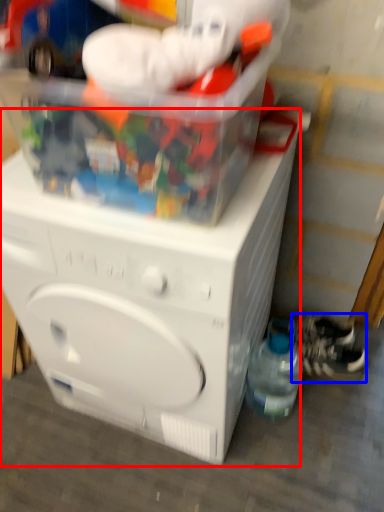
Question: Which object appears closest to the camera in this image, washing machine (highlighted by a red box) or shoe (highlighted by a blue box)?

Choices:
 (A) washing machine
 (B) shoe

Answer: (A)